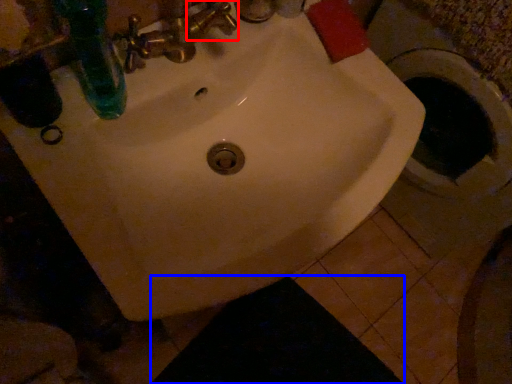
Question: Which object appears farthest to the camera in this image, plumbing fixture (highlighted by a red box) or dark (highlighted by a blue box)?

Choices:
 (A) plumbing fixture
 (B) dark

Answer: (B)